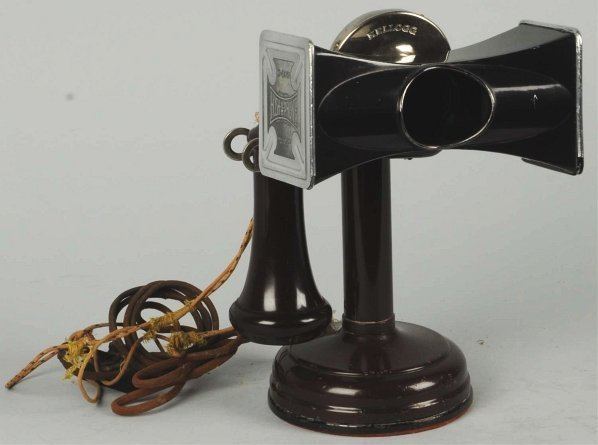
Locate an element on the screen. The width and height of the screenshot is (598, 445). empty counter space is located at coordinates (523, 290), (145, 170).